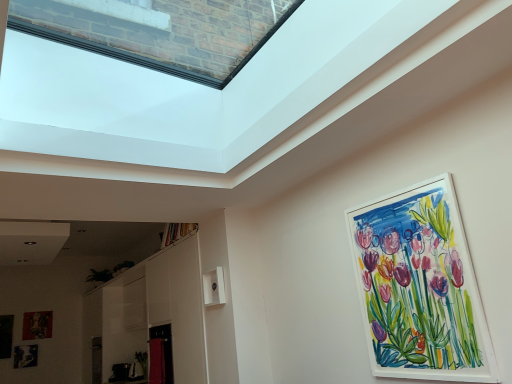
Question: Considering the relative sizes of watercolor paper painting at upper right, the fourth picture frame from the back, and metallic silver picture frame at lower left, which ranks as the 3th picture frame in front-to-back order, in the image provided, is watercolor paper painting at upper right, the fourth picture frame from the back, wider than metallic silver picture frame at lower left, which ranks as the 3th picture frame in front-to-back order,?

Choices:
 (A) no
 (B) yes

Answer: (B)

Question: Could you tell me if watercolor paper painting at upper right, placed as the 1th picture frame when sorted from front to back, is turned towards metallic silver picture frame at lower left, which is the 1th picture frame from bottom to top?

Choices:
 (A) no
 (B) yes

Answer: (A)

Question: Considering the relative sizes of watercolor paper painting at upper right, the 1th picture frame when ordered from right to left, and metallic silver picture frame at lower left, which is counted as the 4th picture frame, starting from the top, in the image provided, is watercolor paper painting at upper right, the 1th picture frame when ordered from right to left, shorter than metallic silver picture frame at lower left, which is counted as the 4th picture frame, starting from the top,?

Choices:
 (A) yes
 (B) no

Answer: (B)

Question: Considering the relative sizes of watercolor paper painting at upper right, the 4th picture frame when ordered from left to right, and metallic silver picture frame at lower left, which ranks as the 3th picture frame in front-to-back order, in the image provided, is watercolor paper painting at upper right, the 4th picture frame when ordered from left to right, bigger than metallic silver picture frame at lower left, which ranks as the 3th picture frame in front-to-back order,?

Choices:
 (A) yes
 (B) no

Answer: (A)

Question: From the image's perspective, would you say watercolor paper painting at upper right, the 4th picture frame when ordered from left to right, is positioned over metallic silver picture frame at lower left, which ranks as the 3th picture frame in front-to-back order?

Choices:
 (A) yes
 (B) no

Answer: (A)

Question: From a real-world perspective, does watercolor paper painting at upper right, placed as the 1th picture frame when sorted from front to back, stand above metallic silver picture frame at lower left, positioned as the 2th picture frame in left-to-right order?

Choices:
 (A) no
 (B) yes

Answer: (B)

Question: Can you confirm if matte black picture frame at lower left, marked as the third picture frame in a left-to-right arrangement, is shorter than matte black picture frame at lower left, the third picture frame from the top?

Choices:
 (A) no
 (B) yes

Answer: (B)

Question: Is matte black picture frame at lower left, which ranks as the first picture frame in back-to-front order, taller than matte black picture frame at lower left, which is counted as the 4th picture frame, starting from the right?

Choices:
 (A) yes
 (B) no

Answer: (B)

Question: Does matte black picture frame at lower left, marked as the third picture frame in a left-to-right arrangement, lie behind matte black picture frame at lower left, which is counted as the second picture frame, starting from the front?

Choices:
 (A) no
 (B) yes

Answer: (B)

Question: Is matte black picture frame at lower left, which is the 2th picture frame from top to bottom, positioned with its back to matte black picture frame at lower left, which is counted as the 4th picture frame, starting from the right?

Choices:
 (A) no
 (B) yes

Answer: (A)

Question: Is matte black picture frame at lower left, which ranks as the first picture frame in back-to-front order, located outside matte black picture frame at lower left, the 3th picture frame from the back?

Choices:
 (A) yes
 (B) no

Answer: (A)

Question: Could you tell me if matte black picture frame at lower left, marked as the second picture frame in a right-to-left arrangement, is facing matte black picture frame at lower left, which is counted as the 4th picture frame, starting from the right?

Choices:
 (A) no
 (B) yes

Answer: (A)

Question: From the image's perspective, is metallic silver picture frame at lower left, positioned as the 2th picture frame in left-to-right order, located beneath matte black picture frame at lower left, marked as the second picture frame in a right-to-left arrangement?

Choices:
 (A) yes
 (B) no

Answer: (A)